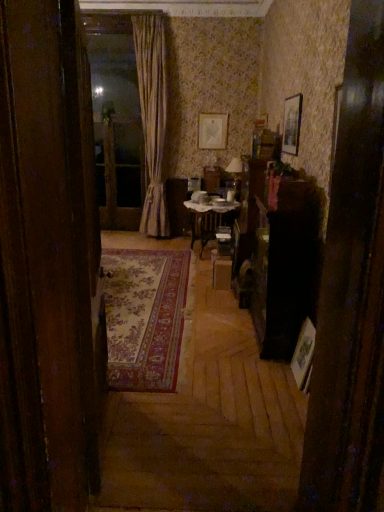
What are the coordinates of `empty space that is to the right of wooden door at left` in the screenshot? It's located at (195, 426).